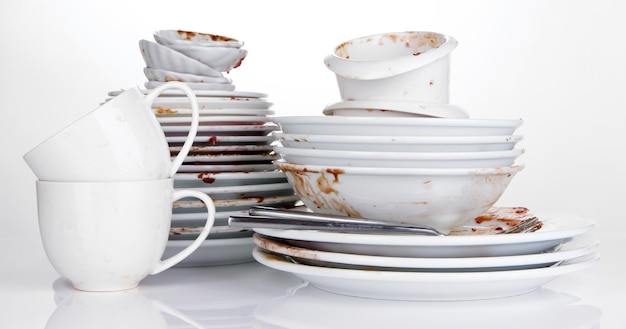
The image size is (626, 329). I want to click on bowl, so click(457, 190), click(391, 158), click(399, 140), click(403, 120).